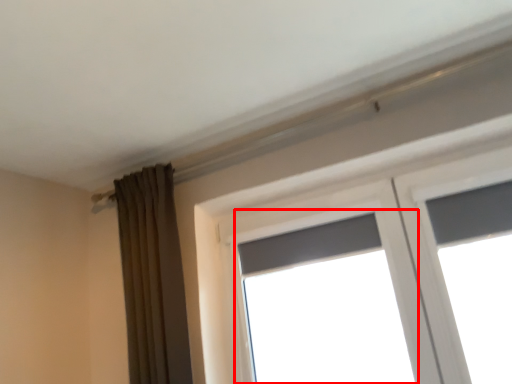
Question: From the image's perspective, what is the correct spatial positioning of window (annotated by the red box) in reference to curtain?

Choices:
 (A) below
 (B) above

Answer: (A)